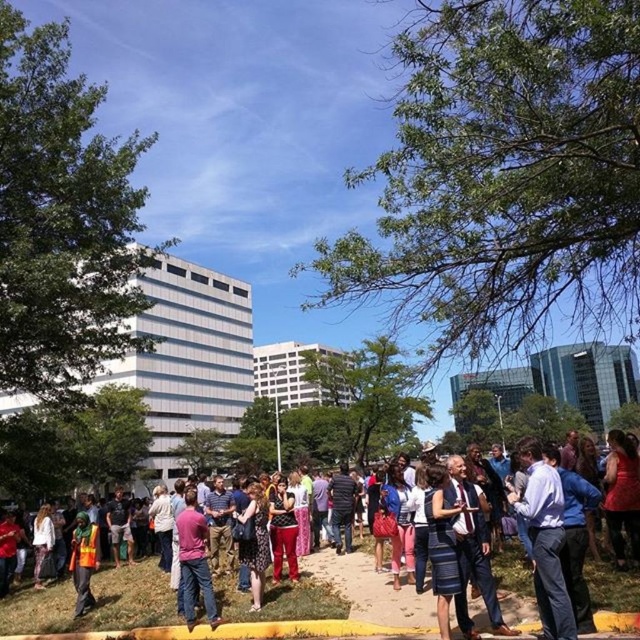
Question: Does blue denim jeans at center appear on the left side of reflective orange vest at lower left?

Choices:
 (A) no
 (B) yes

Answer: (A)

Question: Which point is closer to the camera?

Choices:
 (A) (296, 595)
 (B) (205, 524)

Answer: (B)

Question: Which point is farther to the camera?

Choices:
 (A) reflective orange vest at lower left
 (B) pink fabric shirt at center
 (C) blue denim jeans at center

Answer: (A)

Question: Which point is farther to the camera?

Choices:
 (A) pink fabric shirt at center
 (B) reflective orange vest at lower left
 (C) blue denim jeans at center

Answer: (B)

Question: Can you confirm if blue denim jeans at center is bigger than pink fabric shirt at center?

Choices:
 (A) no
 (B) yes

Answer: (B)

Question: Does blue denim jeans at center have a greater width compared to pink fabric shirt at center?

Choices:
 (A) no
 (B) yes

Answer: (B)